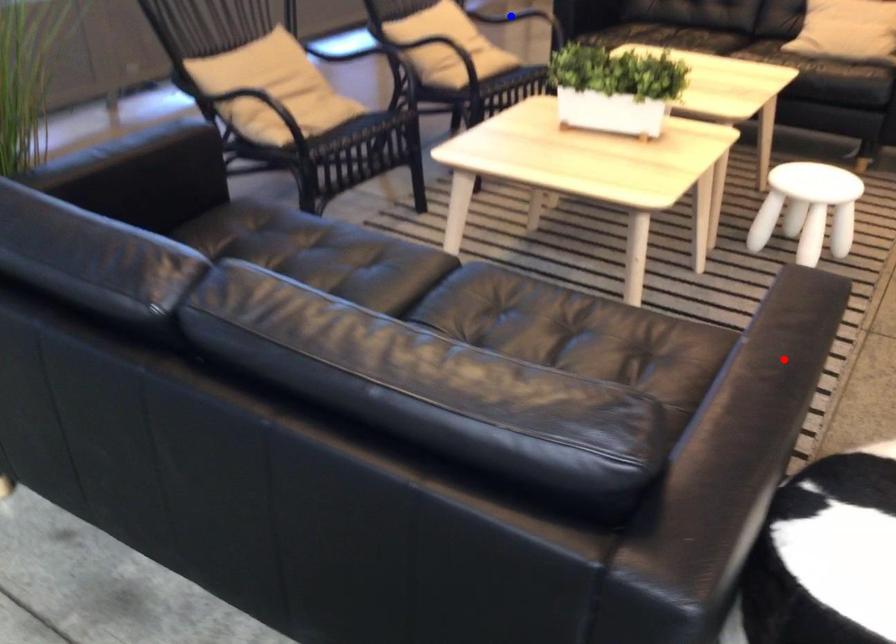
Question: Which of the two points in the image is closer to the camera?

Choices:
 (A) Blue point is closer.
 (B) Red point is closer.

Answer: (B)